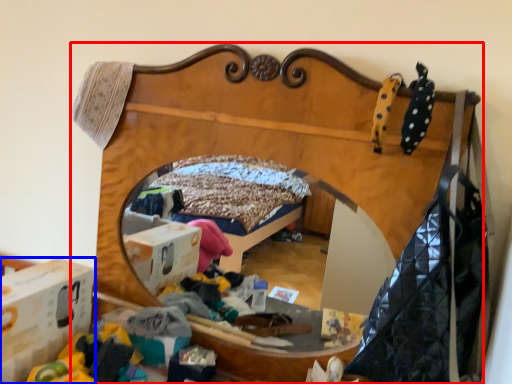
Question: Which of the following is the farthest to the observer, furniture (highlighted by a red box) or cardboard box (highlighted by a blue box)?

Choices:
 (A) furniture
 (B) cardboard box

Answer: (B)